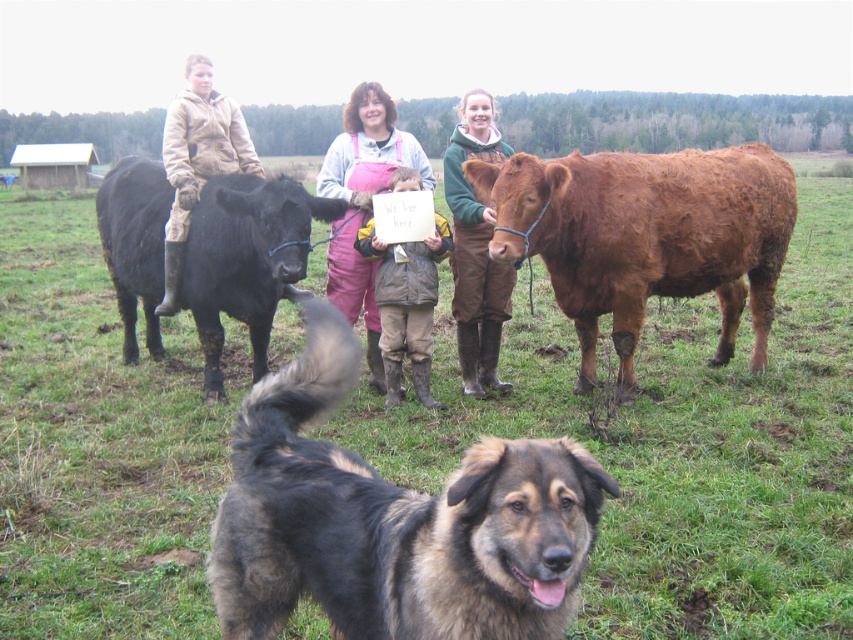
Question: Estimate the real-world distances between objects in this image. Which object is closer to the black glossy bull at left?

Choices:
 (A) brown leather jacket at center
 (B) brown fuzzy bull at right
 (C) brown leather boots at center
 (D) pink overalls at center

Answer: (A)

Question: Is light brown leather jacket at upper left to the right of brown leather jacket at center from the viewer's perspective?

Choices:
 (A) yes
 (B) no

Answer: (B)

Question: Which is nearer to the brown leather jacket at center?

Choices:
 (A) light brown leather jacket at upper left
 (B) brown leather boots at center
 (C) pink overalls at center
 (D) brown fur dog at center

Answer: (C)

Question: Among these objects, which one is nearest to the camera?

Choices:
 (A) brown leather jacket at center
 (B) pink overalls at center

Answer: (A)

Question: Does brown fur dog at center have a greater width compared to light brown leather jacket at upper left?

Choices:
 (A) yes
 (B) no

Answer: (A)

Question: Where is brown fur dog at center located in relation to brown leather jacket at center in the image?

Choices:
 (A) left
 (B) right

Answer: (B)